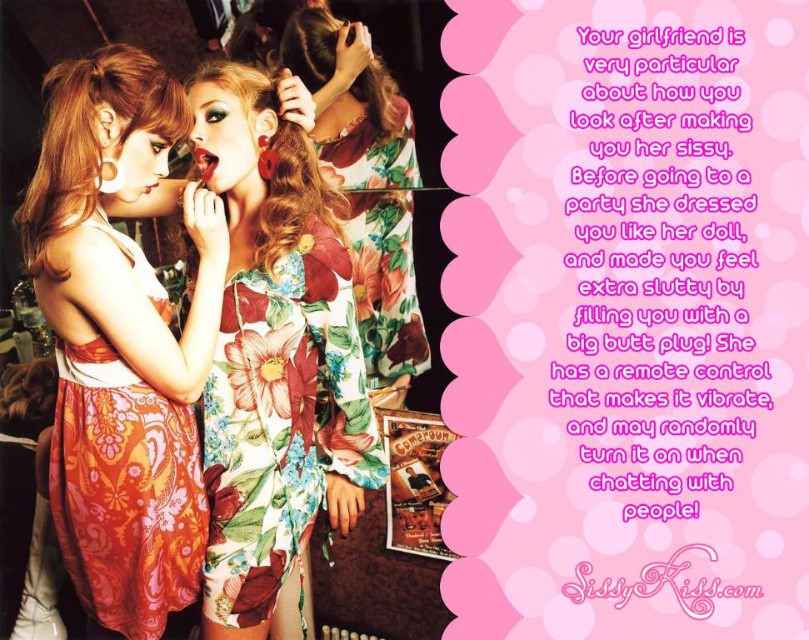
Question: In this image, where is floral fabric dress at center located relative to floral-patterned fabric dress at center?

Choices:
 (A) right
 (B) left

Answer: (B)

Question: Is blonde silky hair at left to the right of curly brown hair at upper center from the viewer's perspective?

Choices:
 (A) no
 (B) yes

Answer: (A)

Question: Which point appears farthest from the camera in this image?

Choices:
 (A) (61, 250)
 (B) (307, 51)

Answer: (B)

Question: Which of the following is the farthest from the observer?

Choices:
 (A) (236, 241)
 (B) (382, 72)

Answer: (B)

Question: Can you confirm if floral-patterned fabric dress at center is wider than fluffy floral dress at center?

Choices:
 (A) no
 (B) yes

Answer: (A)

Question: Which point is farther from the camera taking this photo?

Choices:
 (A) (75, 67)
 (B) (401, 227)
 (C) (380, 88)
 (D) (345, 355)

Answer: (B)